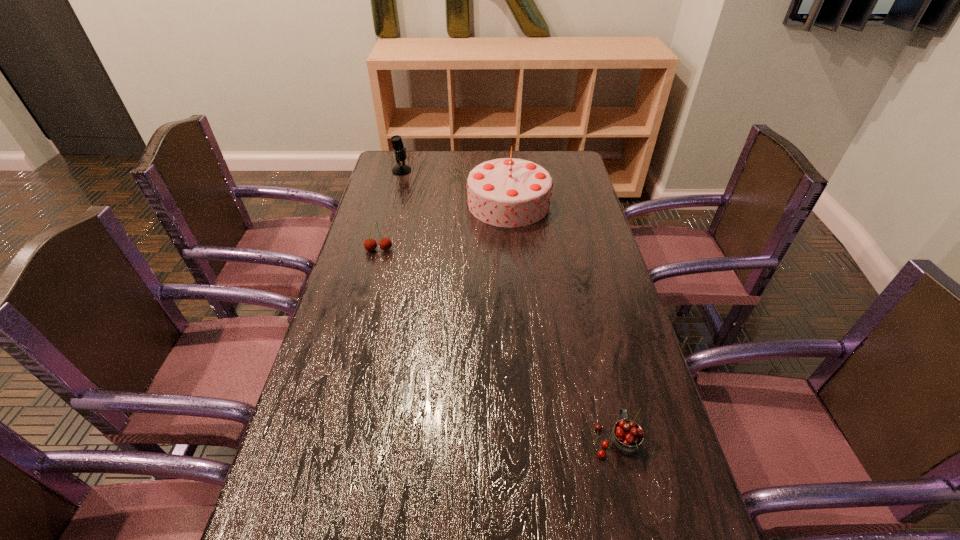
Image resolution: width=960 pixels, height=540 pixels. Find the location of `birthday cake`. birthday cake is located at coordinates (507, 192).

The height and width of the screenshot is (540, 960). In order to click on the tallest object in this screenshot , I will do `click(507, 192)`.

Find the location of a particular element. The width and height of the screenshot is (960, 540). microphone is located at coordinates (401, 169).

Locate an element on the screen. This screenshot has height=540, width=960. the second tallest object is located at coordinates (401, 169).

The image size is (960, 540). In order to click on the taller cherry in this screenshot , I will do `click(370, 244)`.

I want to click on the second shortest object, so click(x=370, y=244).

At what (x,y) coordinates should I click in order to perform the action: click on the right cherry. Please return your answer as a coordinate pair (x, y). Image resolution: width=960 pixels, height=540 pixels. Looking at the image, I should click on (626, 437).

Where is `the shortest object`? The width and height of the screenshot is (960, 540). the shortest object is located at coordinates (626, 437).

Identify the location of free point located 0.080m on the right of the tallest object. (572, 203).

Where is `vacant space located 0.310m on the right of the third shortest object`? vacant space located 0.310m on the right of the third shortest object is located at coordinates (488, 171).